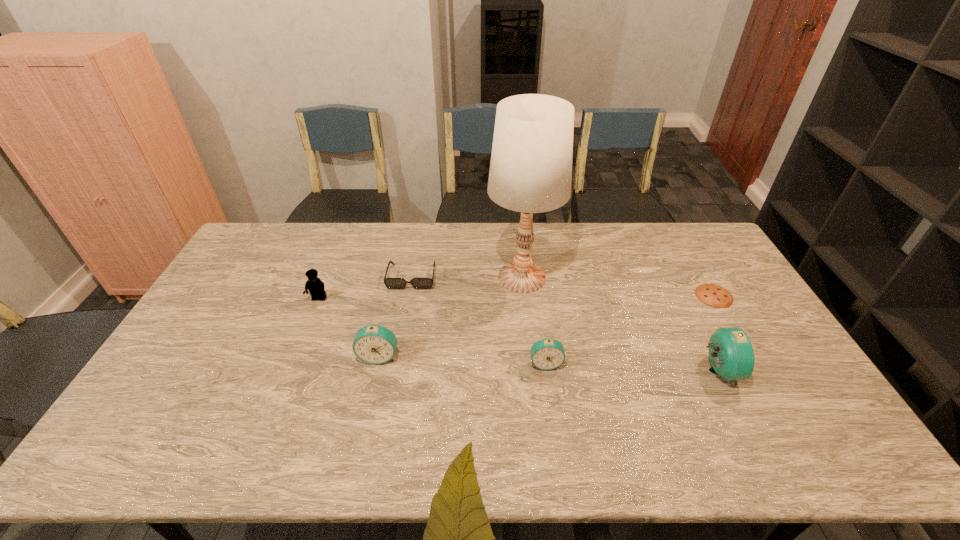
Find the location of a particular element. The height and width of the screenshot is (540, 960). vacant space at the far edge of the desktop is located at coordinates (405, 260).

The width and height of the screenshot is (960, 540). What are the coordinates of `blank area at the near edge` in the screenshot? It's located at (365, 399).

Image resolution: width=960 pixels, height=540 pixels. What are the coordinates of `free location at the left edge` in the screenshot? It's located at (203, 384).

The height and width of the screenshot is (540, 960). I want to click on vacant space at the far left corner, so click(260, 260).

Where is `vacant region at the far right corner of the desktop`? vacant region at the far right corner of the desktop is located at coordinates (708, 261).

Identify the location of free area in between the second tallest alarm clock and the rightmost object. Image resolution: width=960 pixels, height=540 pixels. (546, 326).

The image size is (960, 540). Identify the location of vacant space that's between the tallest object and the sixth tallest object. (467, 277).

At what (x,y) coordinates should I click in order to perform the action: click on vacant region between the shortest alarm clock and the tallest object. Please return your answer as a coordinate pair (x, y). This screenshot has width=960, height=540. Looking at the image, I should click on (534, 320).

Image resolution: width=960 pixels, height=540 pixels. Find the location of `empty space that is in between the rightmost object and the leftmost object`. empty space that is in between the rightmost object and the leftmost object is located at coordinates (516, 298).

Where is `blank region between the rightmost object and the tallest object`? blank region between the rightmost object and the tallest object is located at coordinates (618, 287).